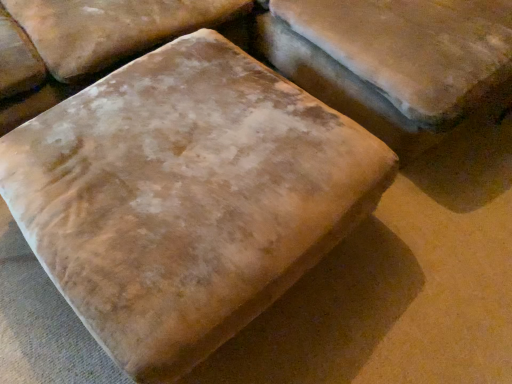
Describe the element at coordinates (186, 198) in the screenshot. This screenshot has height=384, width=512. I see `matte brown bread at center` at that location.

What is the approximate height of matte brown bread at center?

17.51 inches.

You are a GUI agent. You are given a task and a screenshot of the screen. Output one action in this format:
    pyautogui.click(x=<x>, y=<y>)
    Task: Click on the matte brown bread at center
    This screenshot has height=384, width=512.
    Given the screenshot: What is the action you would take?
    pyautogui.click(x=186, y=198)

In order to face matte brown bread at center, should I rotate leftwards or rightwards?

Rotate your view left by about 8.257°.

Where is `matte brown bread at center`? This screenshot has width=512, height=384. matte brown bread at center is located at coordinates (186, 198).